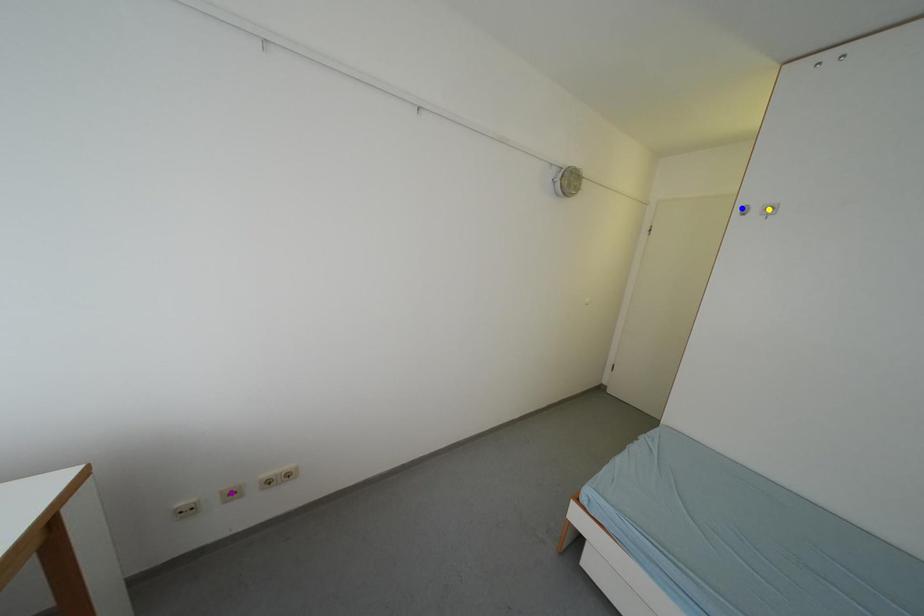
Order these from nearest to farthest:
blue point
yellow point
purple point

purple point
yellow point
blue point